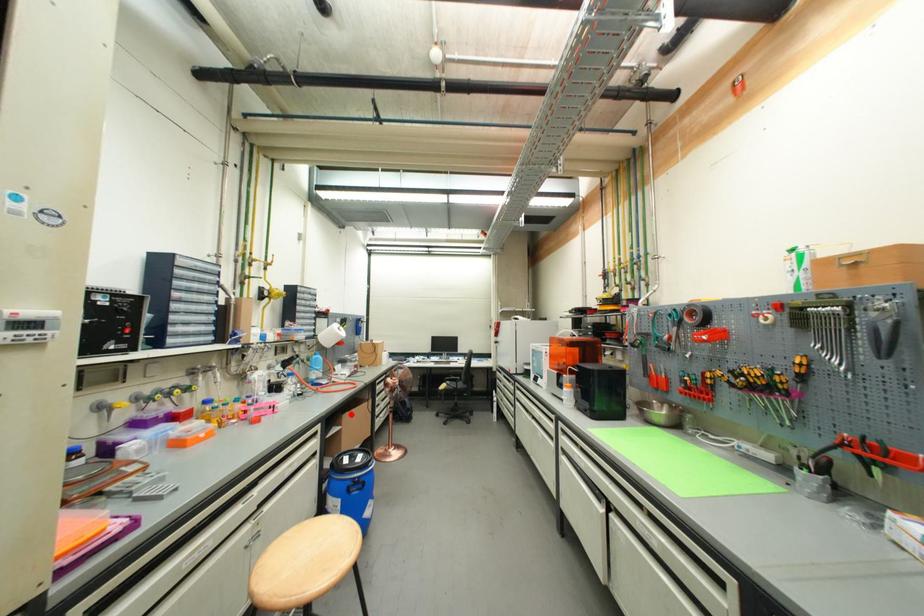
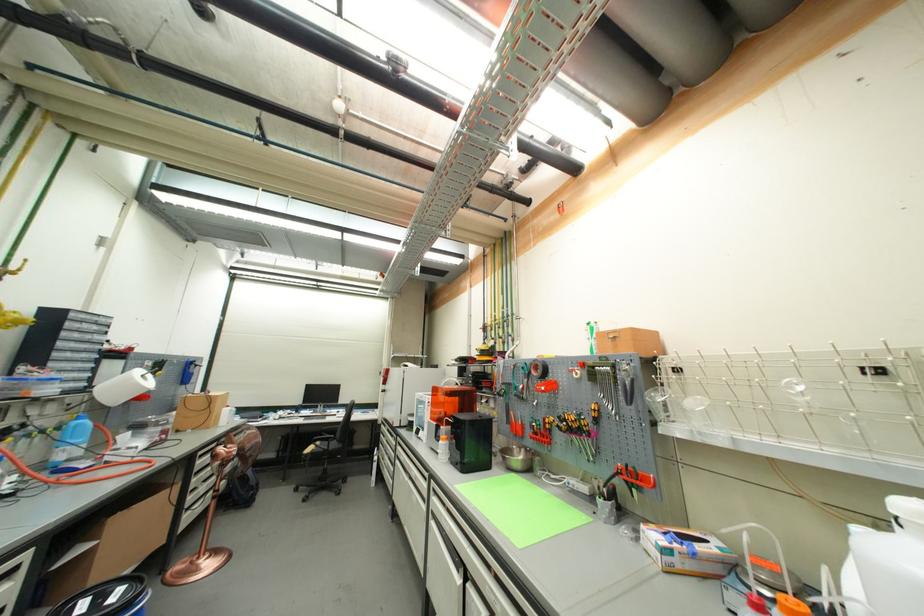
Question: I am providing you with two images of the same scene from different viewpoints. In image1, a red point is highlighted. Considering the same 3D point in image2, which of the following is correct?

Choices:
 (A) It is closer
 (B) It is farther

Answer: (B)